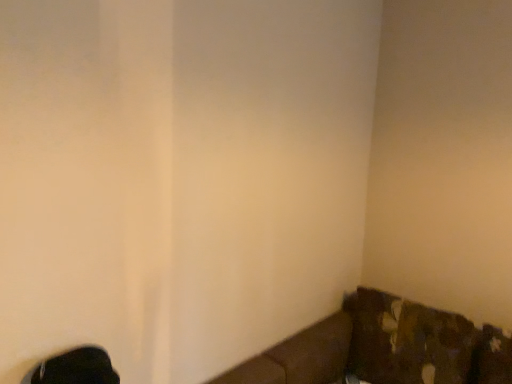
What do you see at coordinates (407, 341) in the screenshot?
I see `brown fabric pillow at lower right` at bounding box center [407, 341].

In order to face brown fabric pillow at lower right, should I rotate leftwards or rightwards?

Rotate right and turn 19.515 degrees.

I want to click on brown fabric pillow at lower right, so click(x=407, y=341).

I want to click on brown fabric pillow at lower right, so click(407, 341).